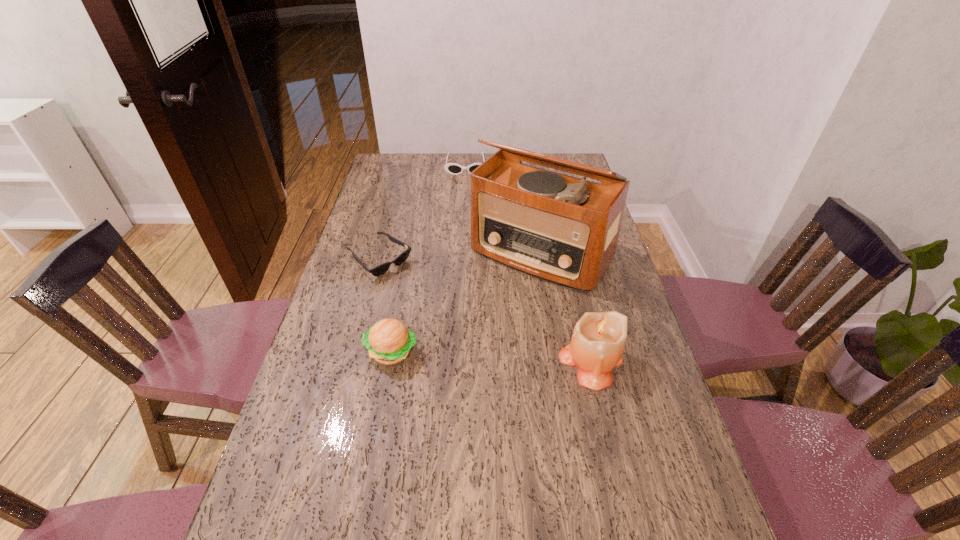
Where is `hamburger`? This screenshot has width=960, height=540. hamburger is located at coordinates (388, 341).

The height and width of the screenshot is (540, 960). Identify the location of the fourth shortest object. (598, 340).

The width and height of the screenshot is (960, 540). What are the coordinates of `the farther sunglasses` in the screenshot? It's located at (452, 168).

Find the location of `the right sunglasses`. the right sunglasses is located at coordinates (452, 168).

This screenshot has width=960, height=540. Find the location of `the left sunglasses`. the left sunglasses is located at coordinates (376, 271).

This screenshot has height=540, width=960. What are the coordinates of `radio receiver` in the screenshot? It's located at (562, 229).

Identify the location of free space located 0.050m on the left of the third tallest object. The image size is (960, 540). (346, 352).

Locate an element on the screen. Image resolution: width=960 pixels, height=540 pixels. free space located 0.110m on the left of the second tallest object is located at coordinates (517, 361).

The image size is (960, 540). In order to click on vacant region located with the lenses of the farthest object facing outward in this screenshot , I will do `click(466, 190)`.

Where is `blank space located with the lenses of the farthest object facing outward`? blank space located with the lenses of the farthest object facing outward is located at coordinates (465, 228).